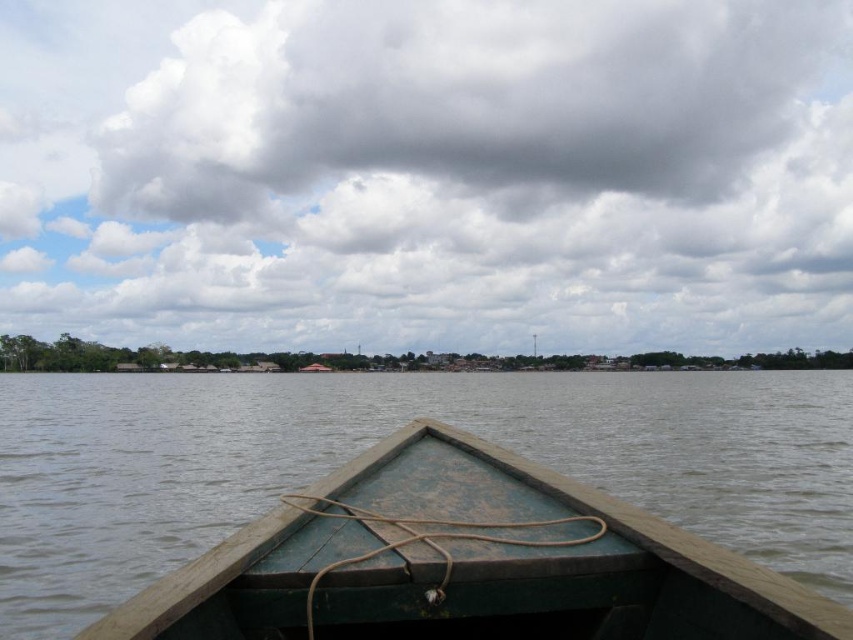
Question: Which object appears farthest from the camera in this image?

Choices:
 (A) green weathered wood boat at center
 (B) cloudy sky at upper center

Answer: (B)

Question: Which point is closer to the camera?

Choices:
 (A) (294, 557)
 (B) (421, 301)

Answer: (A)

Question: Can you confirm if cloudy sky at upper center is positioned above green weathered wood boat at center?

Choices:
 (A) no
 (B) yes

Answer: (B)

Question: From the image, what is the correct spatial relationship of cloudy sky at upper center in relation to green weathered wood boat at center?

Choices:
 (A) above
 (B) below

Answer: (A)

Question: Does cloudy sky at upper center appear under green weathered wood boat at center?

Choices:
 (A) yes
 (B) no

Answer: (B)